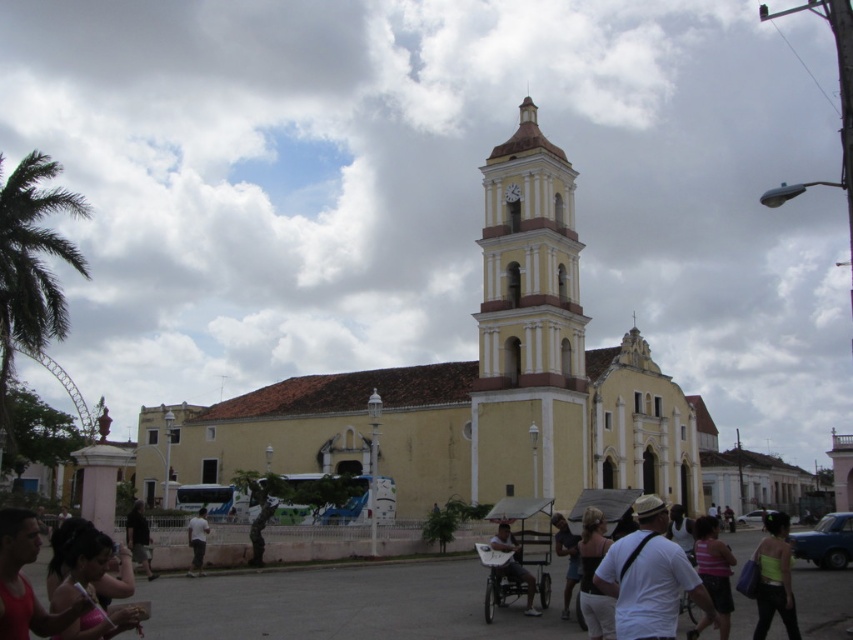
Does pink fabric top at lower right have a greater width compared to dark brown leather pants at lower left?

No, pink fabric top at lower right is not wider than dark brown leather pants at lower left.

At what (x,y) coordinates should I click in order to perform the action: click on pink fabric top at lower right. Please return your answer as a coordinate pair (x, y). The height and width of the screenshot is (640, 853). Looking at the image, I should click on (714, 568).

Which is in front, point (715, 540) or point (135, 531)?

Point (715, 540) is in front.

Where is `pink fabric top at lower right`? pink fabric top at lower right is located at coordinates (714, 568).

Is white matte shirt at center thinner than matte white shirt at center?

In fact, white matte shirt at center might be wider than matte white shirt at center.

This screenshot has height=640, width=853. Describe the element at coordinates (648, 577) in the screenshot. I see `white matte shirt at center` at that location.

Who is more forward, (614,563) or (589,596)?

Point (614,563)

Find the location of a particular element. The image size is (853, 640). white matte shirt at center is located at coordinates (648, 577).

Is matte white shirt at center to the left of light blue denim shorts at center from the viewer's perspective?

Indeed, matte white shirt at center is positioned on the left side of light blue denim shorts at center.

Is point (604, 529) behind point (558, 554)?

No.

Locate an element on the screen. matte white shirt at center is located at coordinates (592, 577).